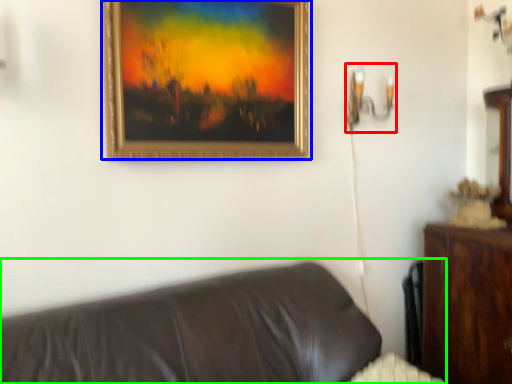
Question: Which object is the closest to the table lamp (highlighted by a red box)? Choose among these: picture frame (highlighted by a blue box) or studio couch (highlighted by a green box).

Choices:
 (A) picture frame
 (B) studio couch

Answer: (A)